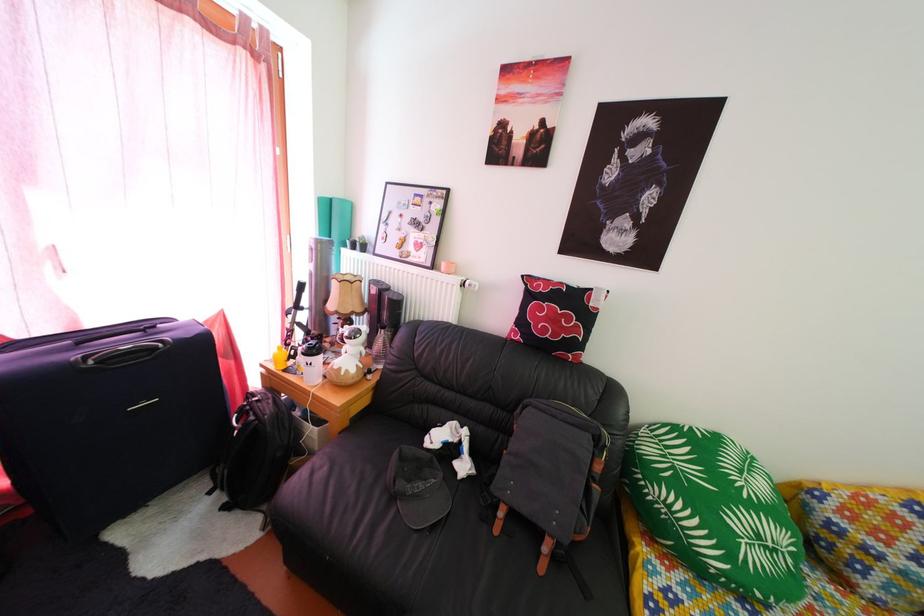
The image size is (924, 616). Describe the element at coordinates (468, 284) in the screenshot. I see `the radiator valve` at that location.